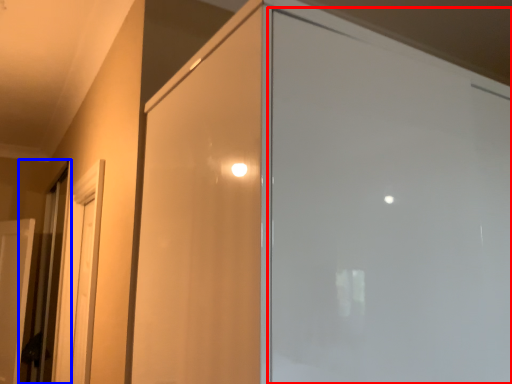
Question: Which point is closer to the camera, screen door (highlighted by a red box) or elevator (highlighted by a blue box)?

Choices:
 (A) screen door
 (B) elevator

Answer: (A)